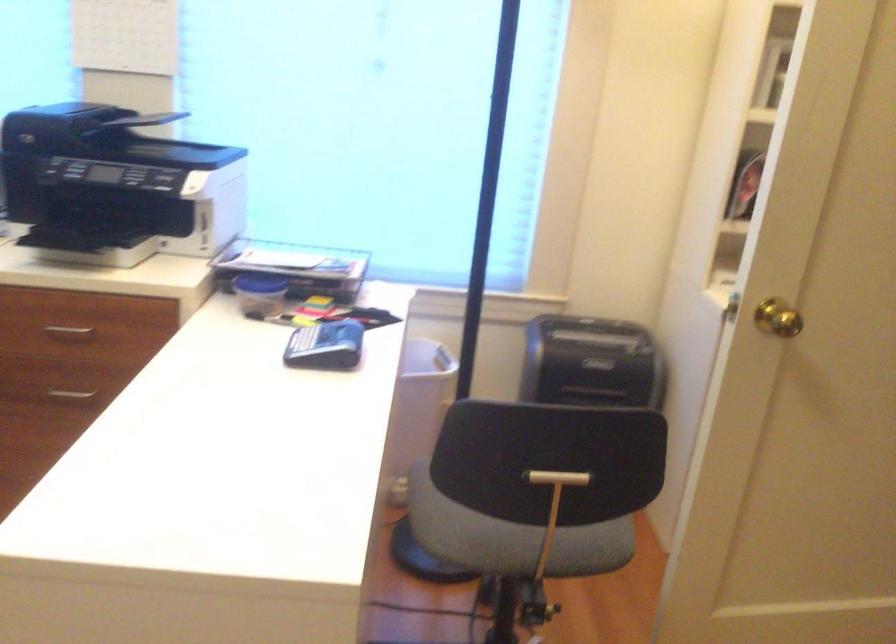
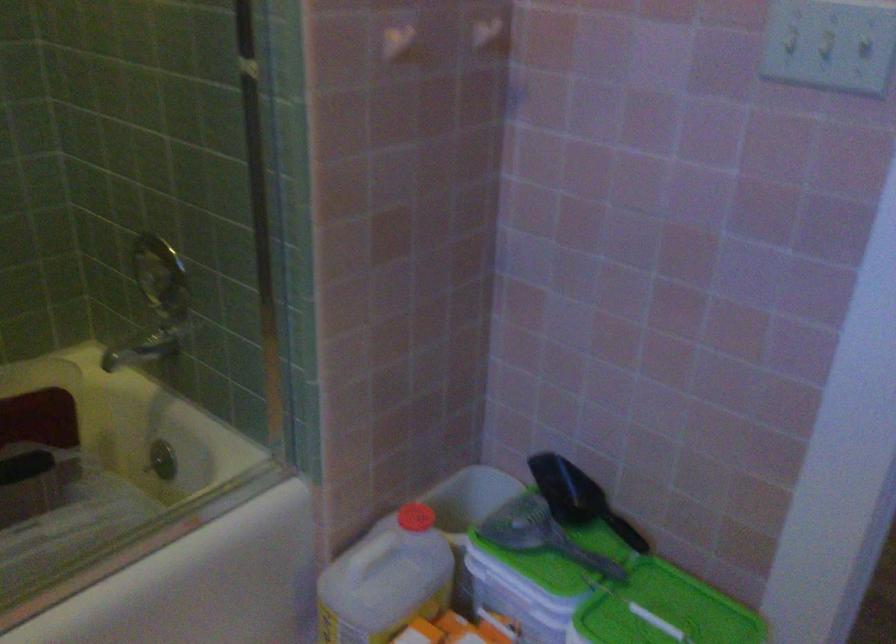
Question: I am providing you with two images of the same scene from different viewpoints. After the viewpoint changes to image2, which objects are now occluded?

Choices:
 (A) round wall container
 (B) chair back handle
 (C) black scoop handle
 (D) red bottle cap

Answer: (B)